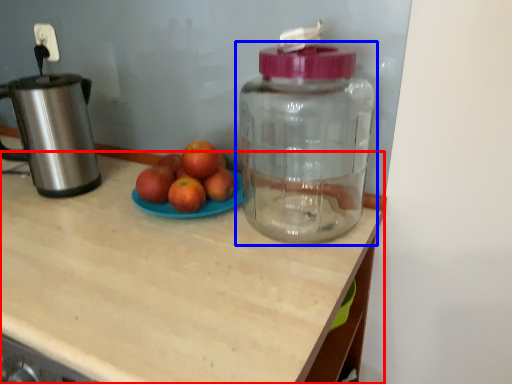
Question: Which object is closer to the camera taking this photo, desk (highlighted by a red box) or bottle (highlighted by a blue box)?

Choices:
 (A) desk
 (B) bottle

Answer: (A)